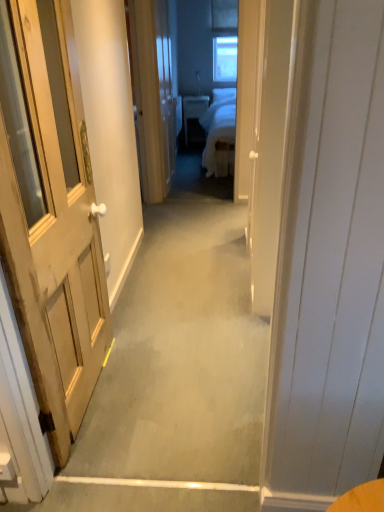
Question: Should I look upward or downward to see wooden door at left?

Choices:
 (A) up
 (B) down

Answer: (A)

Question: Can you confirm if clear glass window at upper center is thinner than wooden door at left?

Choices:
 (A) no
 (B) yes

Answer: (B)

Question: Are clear glass window at upper center and wooden door at left far apart?

Choices:
 (A) yes
 (B) no

Answer: (A)

Question: Is clear glass window at upper center bigger than wooden door at left?

Choices:
 (A) yes
 (B) no

Answer: (B)

Question: Is clear glass window at upper center surrounding wooden door at left?

Choices:
 (A) no
 (B) yes

Answer: (A)

Question: Is the position of clear glass window at upper center more distant than that of wooden door at left?

Choices:
 (A) no
 (B) yes

Answer: (B)

Question: From the image's perspective, is clear glass window at upper center on wooden door at left?

Choices:
 (A) no
 (B) yes

Answer: (B)

Question: Considering the relative sizes of carpeted hallway at center and clear glass window at upper center in the image provided, is carpeted hallway at center bigger than clear glass window at upper center?

Choices:
 (A) yes
 (B) no

Answer: (A)

Question: Is carpeted hallway at center positioned beyond the bounds of clear glass window at upper center?

Choices:
 (A) no
 (B) yes

Answer: (B)

Question: Can you confirm if carpeted hallway at center is smaller than clear glass window at upper center?

Choices:
 (A) no
 (B) yes

Answer: (A)

Question: Is carpeted hallway at center wider than clear glass window at upper center?

Choices:
 (A) yes
 (B) no

Answer: (A)

Question: Does carpeted hallway at center have a lesser height compared to clear glass window at upper center?

Choices:
 (A) no
 (B) yes

Answer: (B)

Question: Does carpeted hallway at center lie behind clear glass window at upper center?

Choices:
 (A) yes
 (B) no

Answer: (B)

Question: Is wooden door at left at the right side of clear glass window at upper center?

Choices:
 (A) no
 (B) yes

Answer: (A)